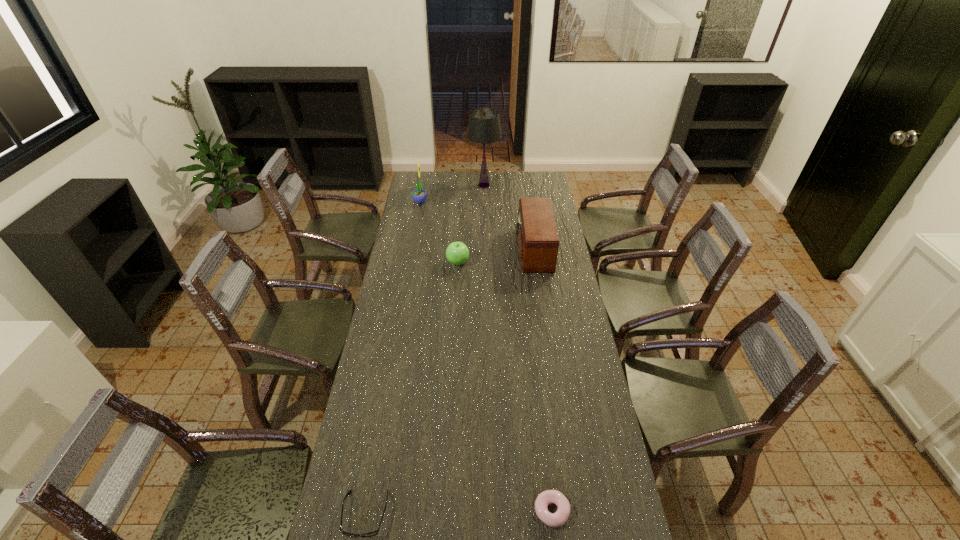
Find the location of a particular element. free spot at the right edge of the desktop is located at coordinates (548, 290).

This screenshot has height=540, width=960. In the image, there is a desktop. What are the coordinates of `free space at the far left corner` in the screenshot? It's located at (434, 173).

This screenshot has width=960, height=540. Find the location of `free space between the lampshade and the doughnut`. free space between the lampshade and the doughnut is located at coordinates (518, 348).

Image resolution: width=960 pixels, height=540 pixels. Identify the location of unoccupied position between the tallest object and the second tallest object. 452,193.

The image size is (960, 540). What are the coordinates of `free spot between the sunflower and the doughnut` in the screenshot? It's located at (486, 356).

The width and height of the screenshot is (960, 540). I want to click on vacant region between the radio receiver and the second farthest object, so click(x=477, y=225).

You are a GUI agent. You are given a task and a screenshot of the screen. Output one action in this format:
    pyautogui.click(x=<x>, y=<y>)
    Task: Click on the vacant region between the sunflower and the tallest object
    The height and width of the screenshot is (540, 960).
    Given the screenshot: What is the action you would take?
    pyautogui.click(x=452, y=193)

Where is `vacant area between the fourth shortest object and the third shortest object`? The width and height of the screenshot is (960, 540). vacant area between the fourth shortest object and the third shortest object is located at coordinates (495, 256).

Identify the location of unoccupied area between the apple and the third tallest object. This screenshot has height=540, width=960. (495, 256).

Select which object appears as the second closest to the third tallest object. Please provide its 2D coordinates. Your answer should be formatted as a tuple, i.e. [(x, y)], where the tuple contains the x and y coordinates of a point satisfying the conditions above.

[(484, 127)]